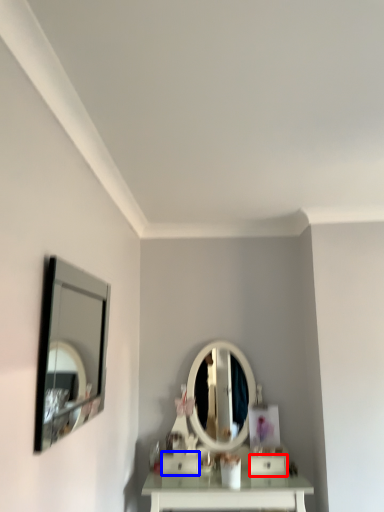
Question: Among these objects, which one is nearest to the camera, drawer (highlighted by a red box) or drawer (highlighted by a blue box)?

Choices:
 (A) drawer
 (B) drawer

Answer: (A)